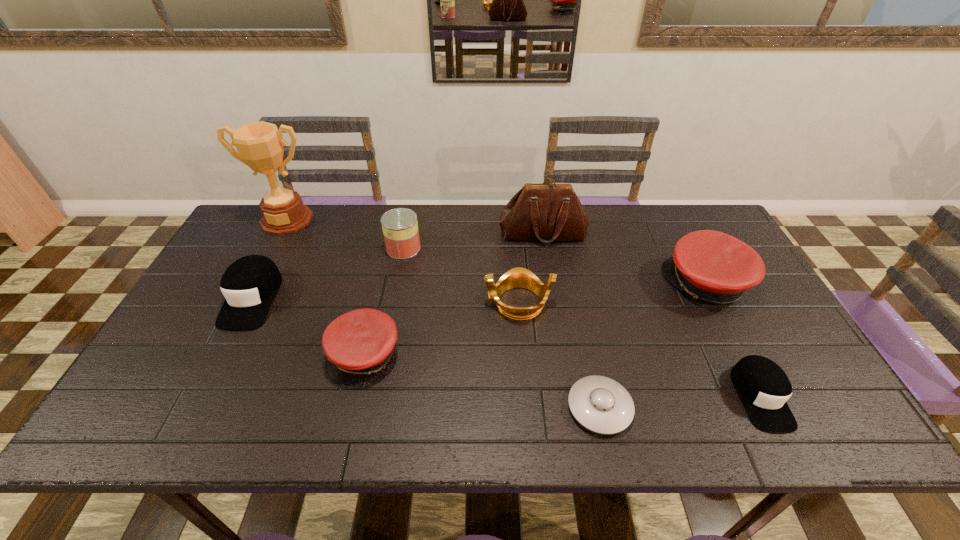
Select which cap appears as the third closest to the second tallest object. Please provide its 2D coordinates. Your answer should be formatted as a tuple, i.e. [(x, y)], where the tuple contains the x and y coordinates of a point satisfying the conditions above.

[(763, 386)]

Where is `free spot that satisfies the following two spatial constraints: 1. on the front-facing side of the right red cap; 2. on the front-facing side of the third cap from right to left`? The width and height of the screenshot is (960, 540). free spot that satisfies the following two spatial constraints: 1. on the front-facing side of the right red cap; 2. on the front-facing side of the third cap from right to left is located at coordinates (743, 355).

Where is `vacant space that satisfies the following two spatial constraints: 1. on the front-facing side of the award; 2. on the right side of the gray saucer`? Image resolution: width=960 pixels, height=540 pixels. vacant space that satisfies the following two spatial constraints: 1. on the front-facing side of the award; 2. on the right side of the gray saucer is located at coordinates (189, 407).

This screenshot has height=540, width=960. What are the coordinates of `vacant space that satisfies the following two spatial constraints: 1. on the front-facing side of the second tallest object; 2. on the left side of the tallest object` in the screenshot? It's located at (279, 233).

Where is `vacant space that satisfies the following two spatial constraints: 1. on the front-facing side of the right red cap; 2. on the front-facing side of the smaller black cap`? The height and width of the screenshot is (540, 960). vacant space that satisfies the following two spatial constraints: 1. on the front-facing side of the right red cap; 2. on the front-facing side of the smaller black cap is located at coordinates (765, 396).

This screenshot has height=540, width=960. Find the location of `vacant region that satisfies the following two spatial constraints: 1. on the front-facing side of the smaller red cap; 2. on the left side of the saucer`. vacant region that satisfies the following two spatial constraints: 1. on the front-facing side of the smaller red cap; 2. on the left side of the saucer is located at coordinates (353, 407).